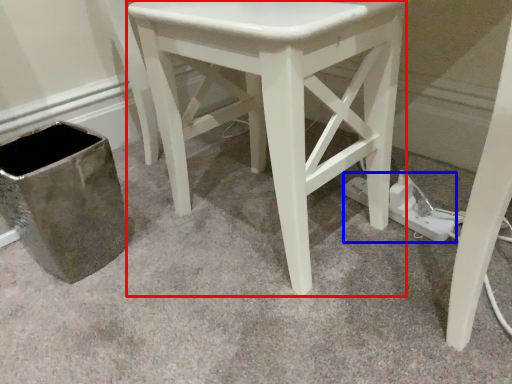
Question: Which of the following is the farthest to the observer, stool (highlighted by a red box) or plug (highlighted by a blue box)?

Choices:
 (A) stool
 (B) plug

Answer: (B)